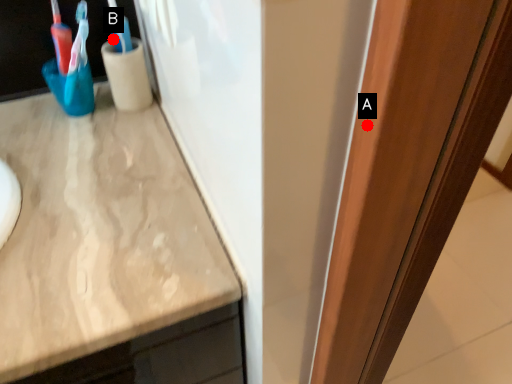
Question: Two points are circled on the image, labeled by A and B beside each circle. Which point is further to the camera?

Choices:
 (A) A is further
 (B) B is further

Answer: (B)